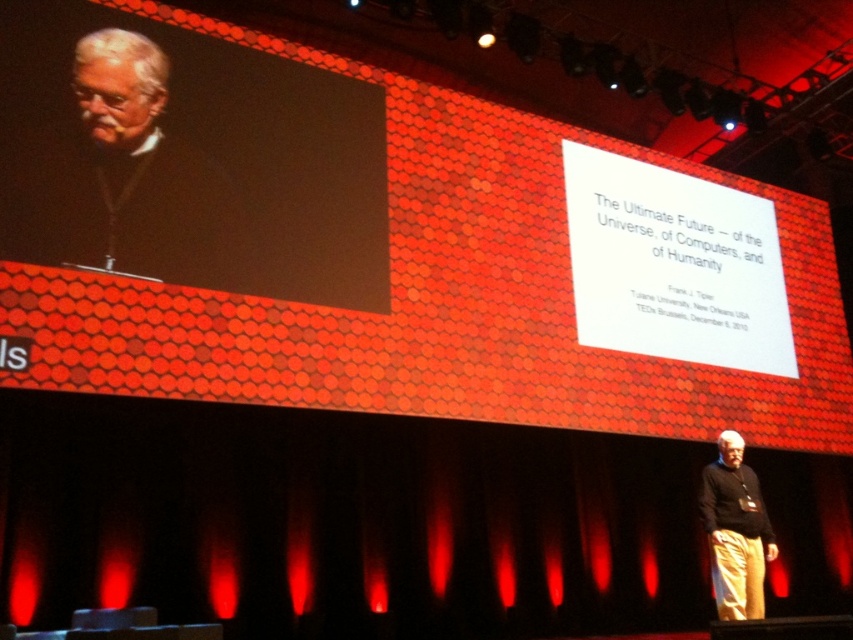
Is matte black laptop at lower right taller than black matte screen at upper left?

No.

What do you see at coordinates (442, 300) in the screenshot?
I see `matte black laptop at lower right` at bounding box center [442, 300].

Who is more forward, (322, 56) or (4, 10)?

Point (4, 10) is in front.

Find the location of `matte black laptop at lower right`. matte black laptop at lower right is located at coordinates (442, 300).

Can you confirm if matte black laptop at lower right is wider than gray hair at left?

No.

Which is in front, point (190, 362) or point (59, 250)?

Point (59, 250)

Is point (397, 192) more distant than point (67, 234)?

Yes, it is.

Where is `matte black laptop at lower right`? This screenshot has height=640, width=853. matte black laptop at lower right is located at coordinates (442, 300).

Who is positioned more to the left, matte black laptop at lower right or black sweater at center?

matte black laptop at lower right is more to the left.

This screenshot has height=640, width=853. Describe the element at coordinates (442, 300) in the screenshot. I see `matte black laptop at lower right` at that location.

Identify the location of matte black laptop at lower right. (442, 300).